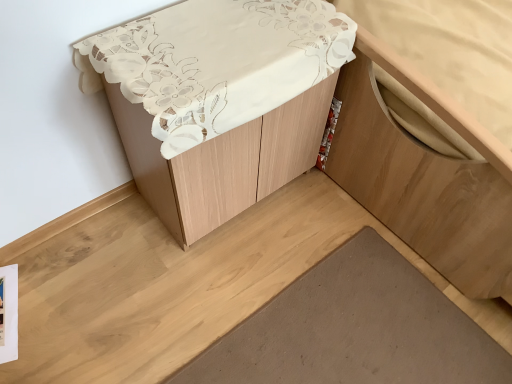
Locate an element on the screen. vacant space underneath brown matte wood plank at lower center (from a real-world perspective) is located at coordinates (359, 337).